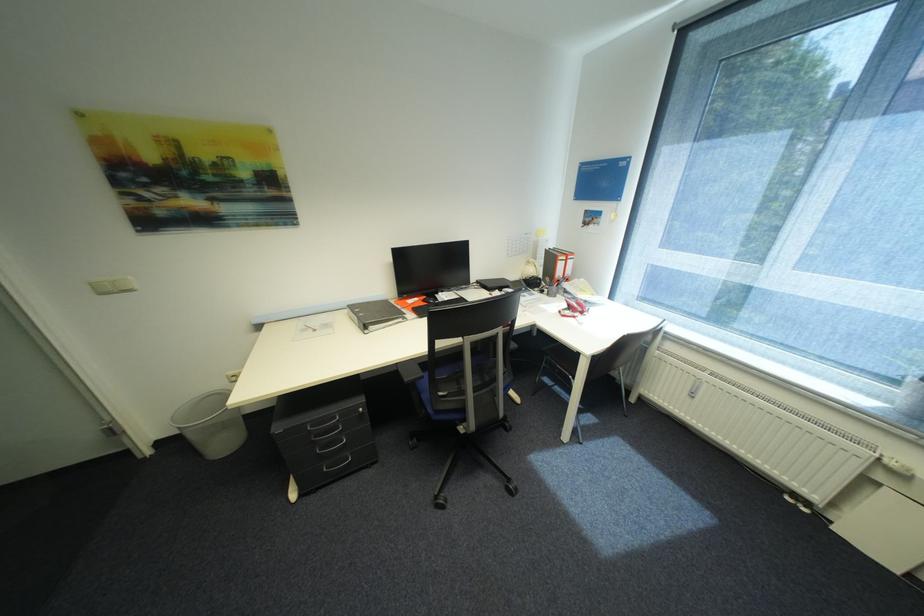
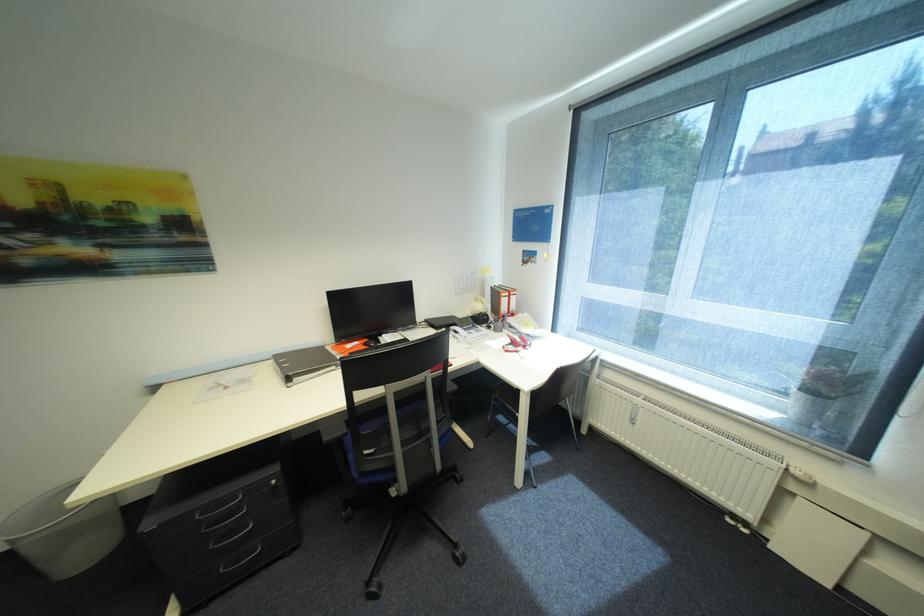
Question: I am providing you with two images of the same scene from different viewpoints. After the viewpoint changes to image2, which objects are now occluded?

Choices:
 (A) white window handle
 (B) black ring binder
 (C) blue chair sitting surface
 (D) none of these

Answer: (D)